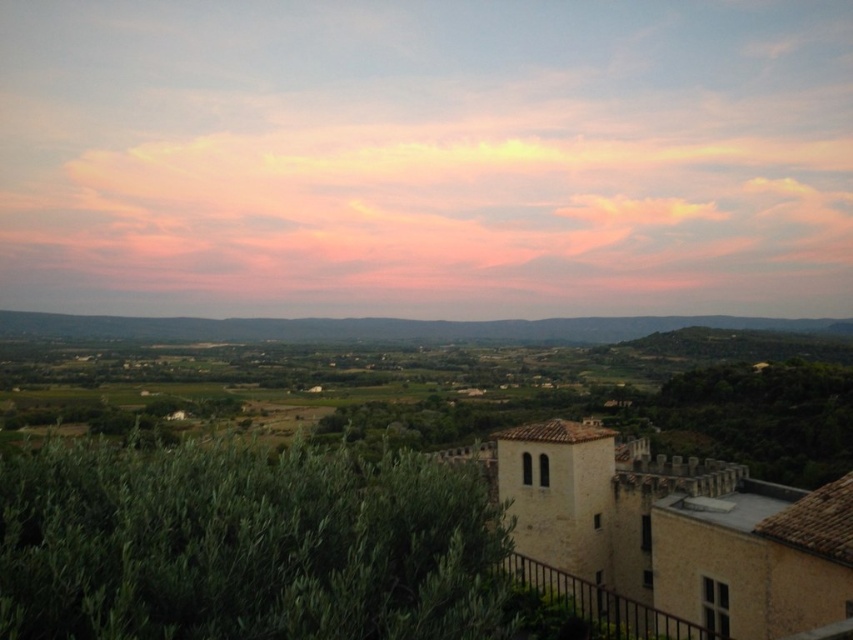
From the picture: You are standing at the point closer to the camera in the image. Which point are you at, point (474, 538) or point (61, 314)?

You are at point (474, 538) because it is closer to the camera than point (61, 314).